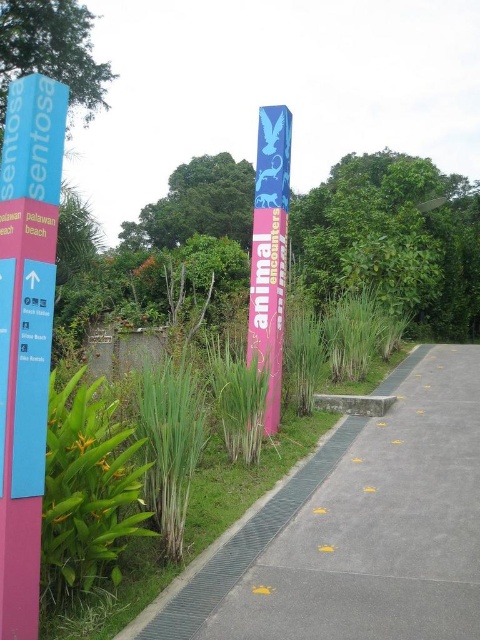
You are a tour guide who needs to adjust the height of two signs so that they are equal. The blue plastic sign at left and the pink glossy pole at center are currently at different heights. Which sign should you lower to achieve equal heights?

The blue plastic sign at left has a greater height compared to the pink glossy pole at center, so you should lower the blue plastic sign at left to match the height of the pink glossy pole at center.

You are a tourist holding a 0.8 meters wide backpack and want to pass through the gap between the blue plastic sign at left and the pink glossy pole at center. Can your backpack fit through the gap without touching either object?

The blue plastic sign at left is larger in size than the pink glossy pole at center, but the exact width of the gap isn not specified. Therefore, it is uncertain if the backpack can fit through without touching either object.